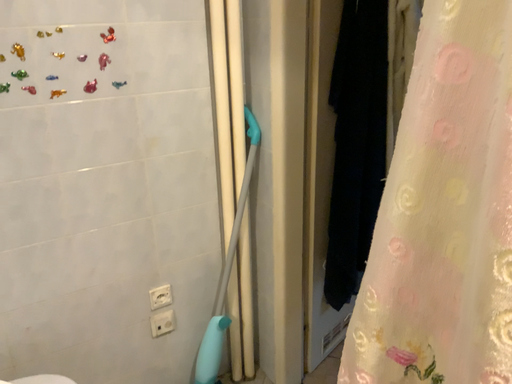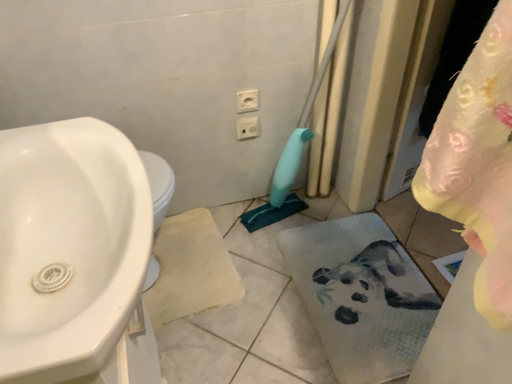
Question: Which way did the camera rotate in the video?

Choices:
 (A) rotated upward
 (B) rotated downward

Answer: (B)